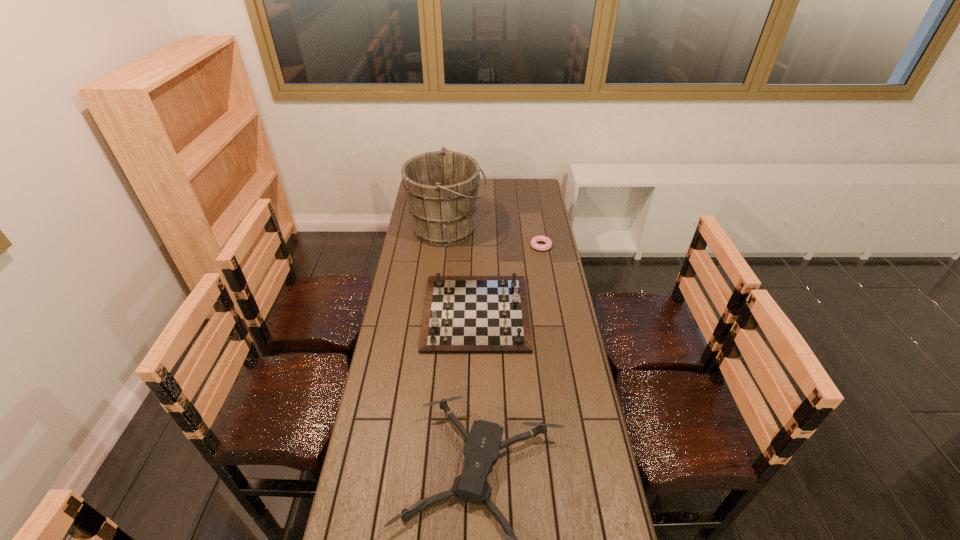
The height and width of the screenshot is (540, 960). In order to click on bucket in this screenshot , I will do `click(441, 187)`.

Locate an element on the screen. The height and width of the screenshot is (540, 960). the third farthest object is located at coordinates (463, 314).

This screenshot has height=540, width=960. I want to click on the third shortest object, so click(463, 314).

Identify the location of the shortest object. The width and height of the screenshot is (960, 540). (540, 238).

Locate an element on the screen. Image resolution: width=960 pixels, height=540 pixels. vacant space located on the handle side of the bucket is located at coordinates (530, 228).

Image resolution: width=960 pixels, height=540 pixels. Find the location of `blank space located 0.050m on the board of the chessboard`. blank space located 0.050m on the board of the chessboard is located at coordinates (540, 313).

Locate an element on the screen. This screenshot has height=540, width=960. free space located 0.060m on the front of the shortest object is located at coordinates (543, 260).

The width and height of the screenshot is (960, 540). What are the coordinates of `bucket at the left edge` in the screenshot? It's located at (441, 187).

The image size is (960, 540). I want to click on chessboard situated at the left edge, so click(x=463, y=314).

This screenshot has height=540, width=960. I want to click on object that is at the right edge, so click(540, 238).